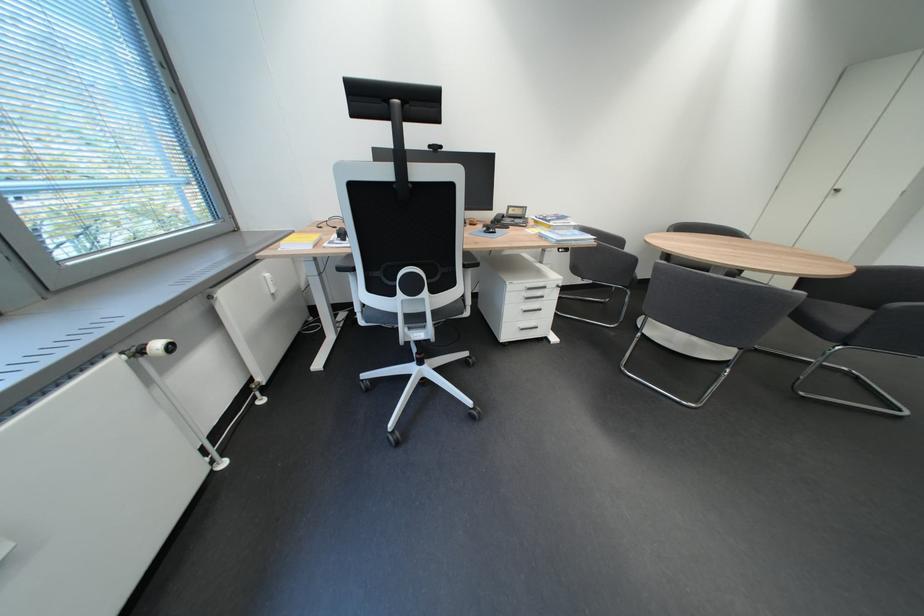
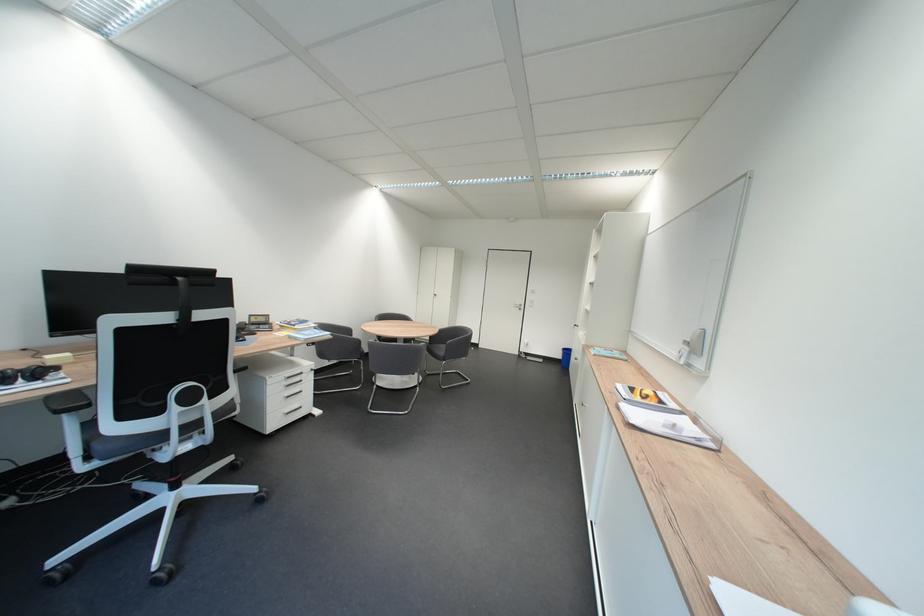
Question: The images are taken continuously from a first-person perspective. In which direction is your viewpoint rotating?

Choices:
 (A) Left
 (B) Right
 (C) Up
 (D) Down

Answer: (B)